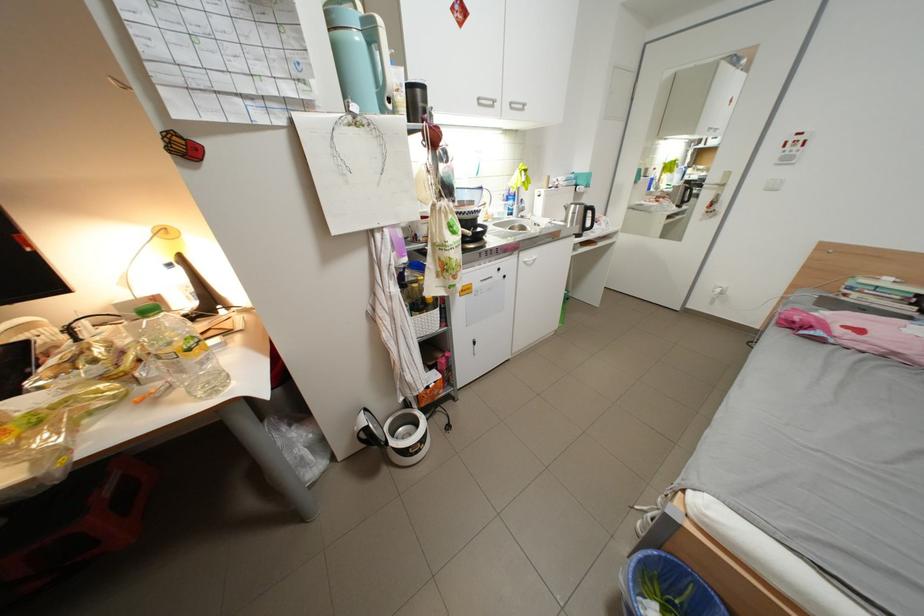
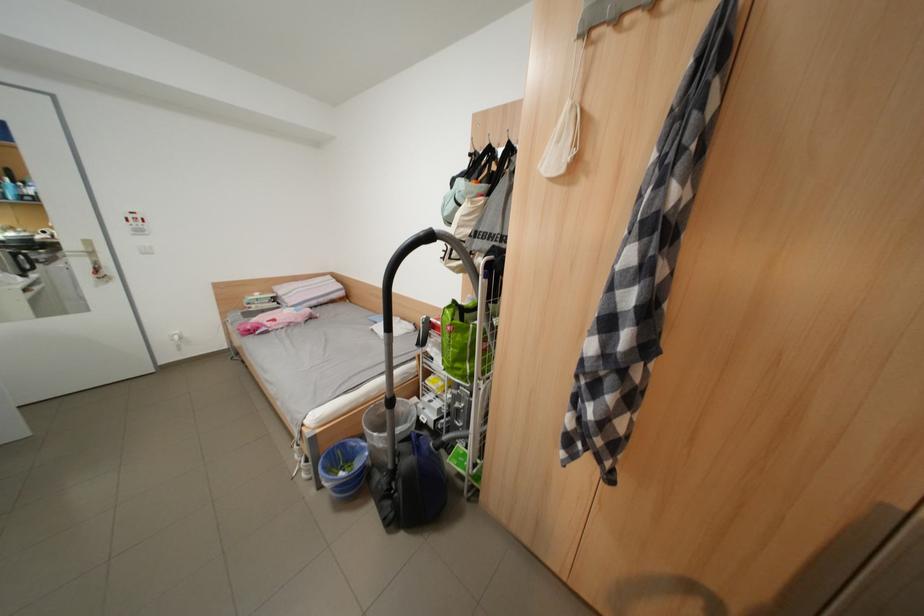
The point at (806, 140) is marked in the first image. Where is the corresponding point in the second image?

(142, 217)